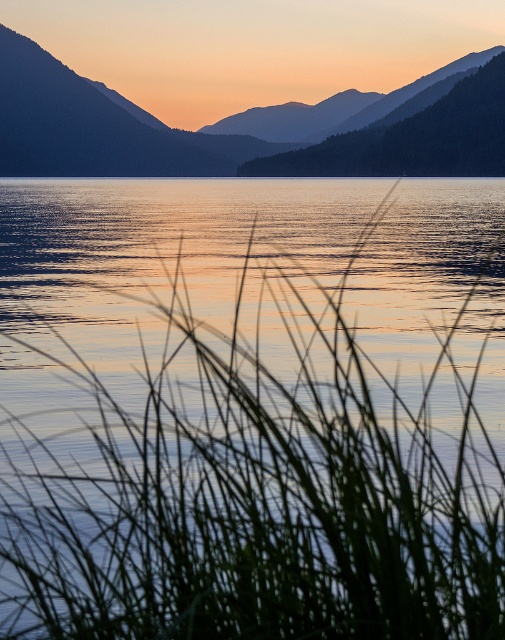
Which is more to the right, green grass at center or silvery metallic mountain at upper left?

green grass at center

This screenshot has width=505, height=640. I want to click on green grass at center, so click(251, 408).